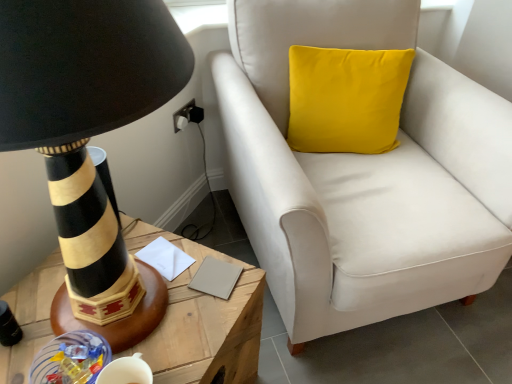
Where is `vacant area that is in front of beige matte notepad at center, the first notepad when ordered from right to left`? vacant area that is in front of beige matte notepad at center, the first notepad when ordered from right to left is located at coordinates (196, 324).